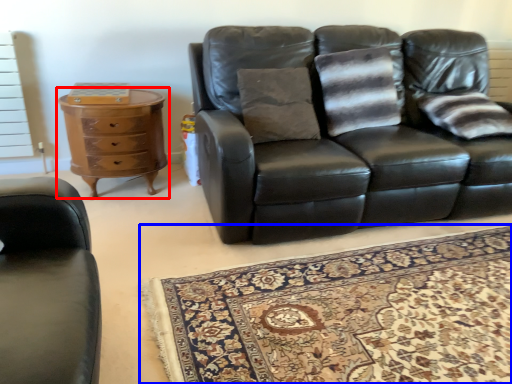
Question: Which of the following is the closest to the observer, chest of drawers (highlighted by a red box) or mat (highlighted by a blue box)?

Choices:
 (A) chest of drawers
 (B) mat

Answer: (B)